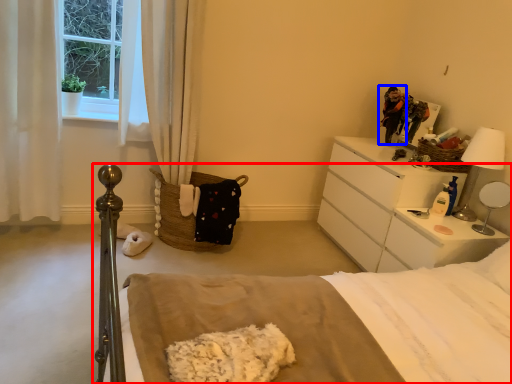
Question: Which object appears closest to the camera in this image, bed (highlighted by a red box) or person (highlighted by a blue box)?

Choices:
 (A) bed
 (B) person

Answer: (A)